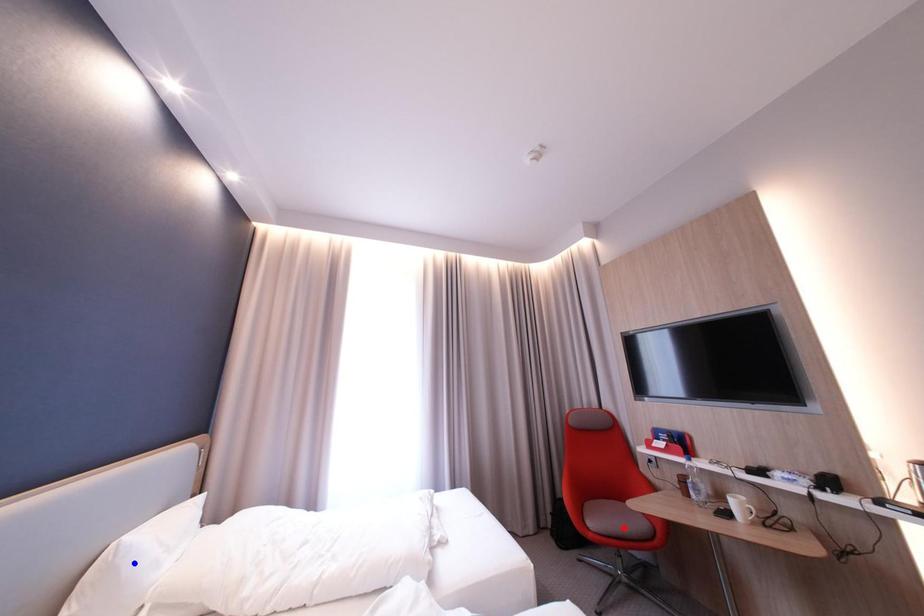
Question: In the image, two points are highlighted. Which point is nearer to the camera? Reply with the corresponding letter.

Choices:
 (A) blue point
 (B) red point

Answer: (A)